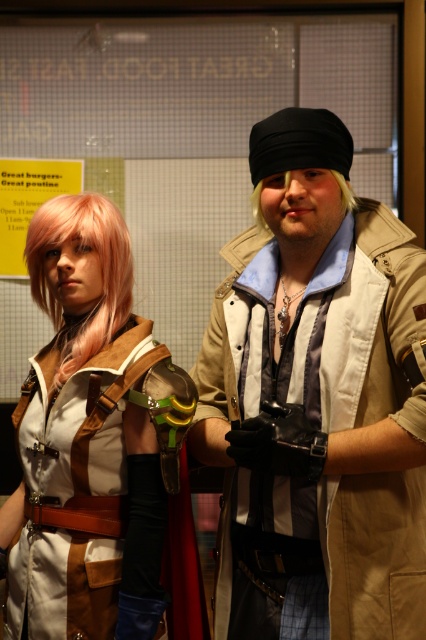
You are a photographer setting up for a photoshoot. You need to ensure that the matte brown vest at center and the blonde hair wig at center are both visible in the frame. Based on their positions, which object should you adjust to be closer to the camera to keep both in focus?

The matte brown vest at center is positioned on the left side of blonde hair wig at center. To keep both in focus, you should adjust the blonde hair wig at center to be closer to the camera since it is on the right side of the vest.

What is located at the coordinates point [92,438]?

The location at point [92,438] contains a matte brown vest at center.

You are a photographer setting up for a photoshoot. You need to adjust the lighting so that the blonde hair wig at center is fully visible without being blocked by the pink synthetic wig at left. Based on the scene description, what adjustment should you make?

Result: The blonde hair wig at center is behind the pink synthetic wig at left, so to make the blonde hair wig at center fully visible, you should move the pink synthetic wig at left to the side or adjust the position of the blonde hair wig at center to bring it forward.